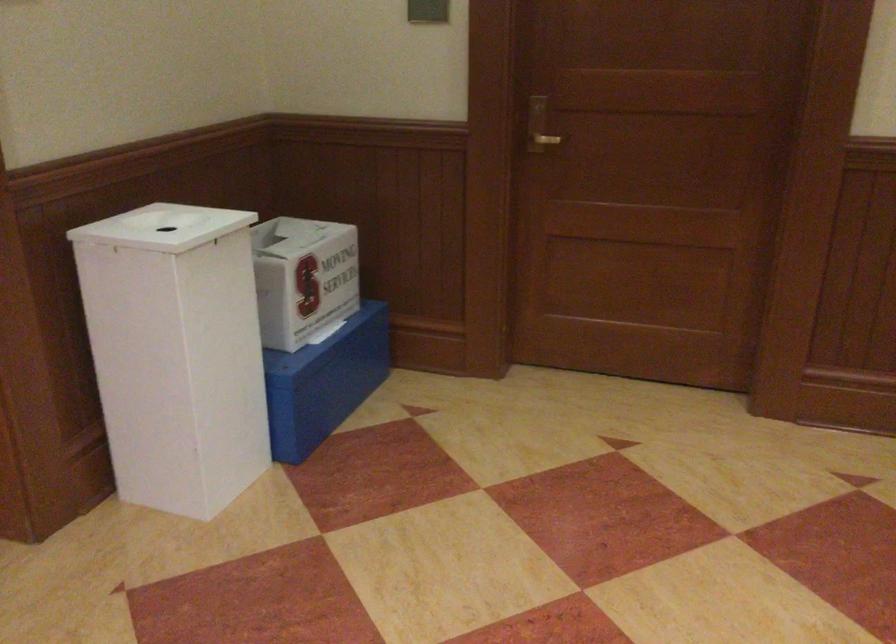
What are the coordinates of `blue plastic container` in the screenshot? It's located at (323, 382).